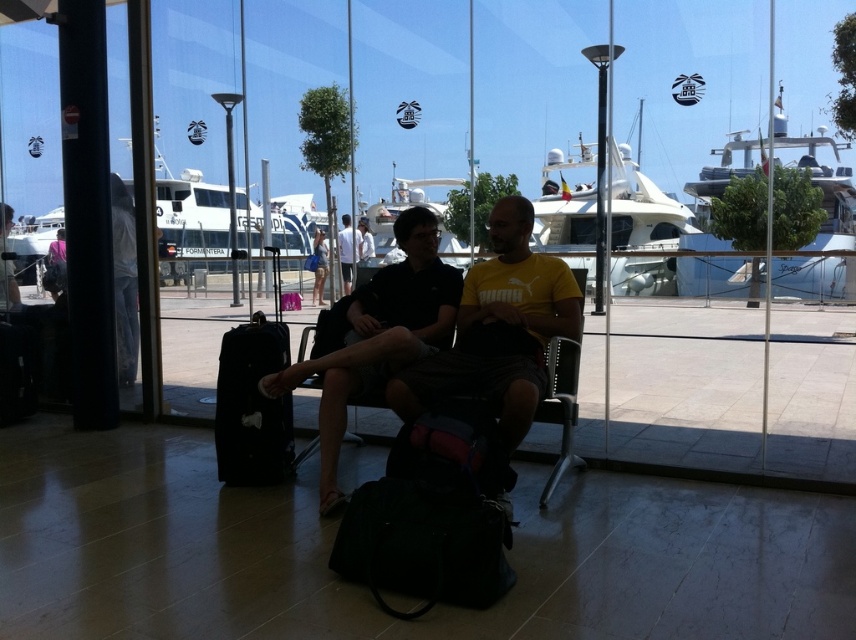
Question: Does black fabric suitcase at left have a smaller size compared to yellow cotton t-shirt at center?

Choices:
 (A) no
 (B) yes

Answer: (B)

Question: Is matte black shirt at center to the right of yellow cotton t-shirt at center from the viewer's perspective?

Choices:
 (A) no
 (B) yes

Answer: (B)

Question: Which point is farther from the camera taking this photo?

Choices:
 (A) (397, 328)
 (B) (235, 336)
 (C) (345, 216)

Answer: (C)

Question: Does matte black shirt at center have a smaller size compared to yellow cotton t-shirt at center?

Choices:
 (A) yes
 (B) no

Answer: (B)

Question: Which point is closer to the camera taking this photo?

Choices:
 (A) (321, 237)
 (B) (491, 262)
 (C) (248, 451)
 (D) (342, 252)

Answer: (C)

Question: Which point is closer to the camera?

Choices:
 (A) (256, 385)
 (B) (420, 390)
 (C) (340, 257)

Answer: (B)